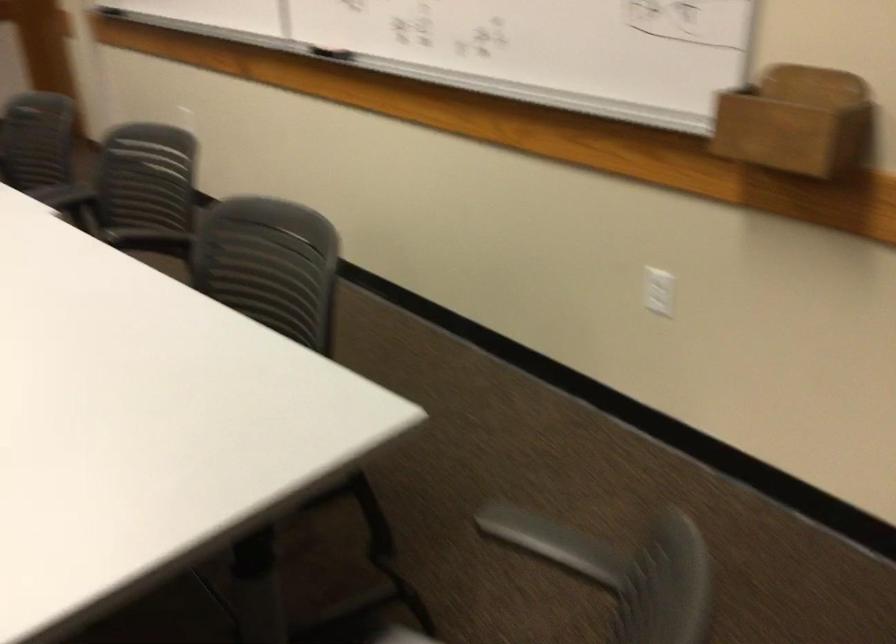
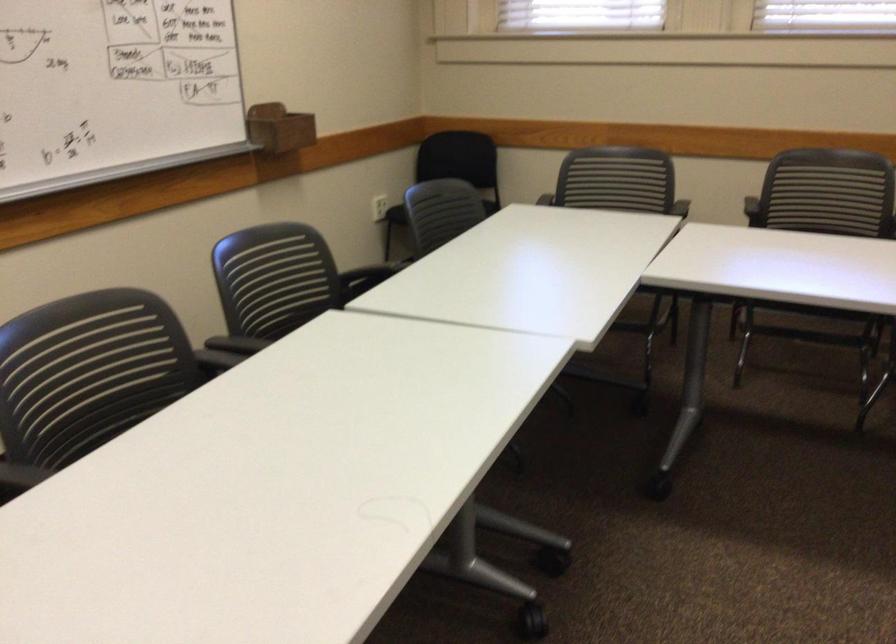
Locate, in the second image, the point that corresponds to (750,102) in the first image.

(279, 128)